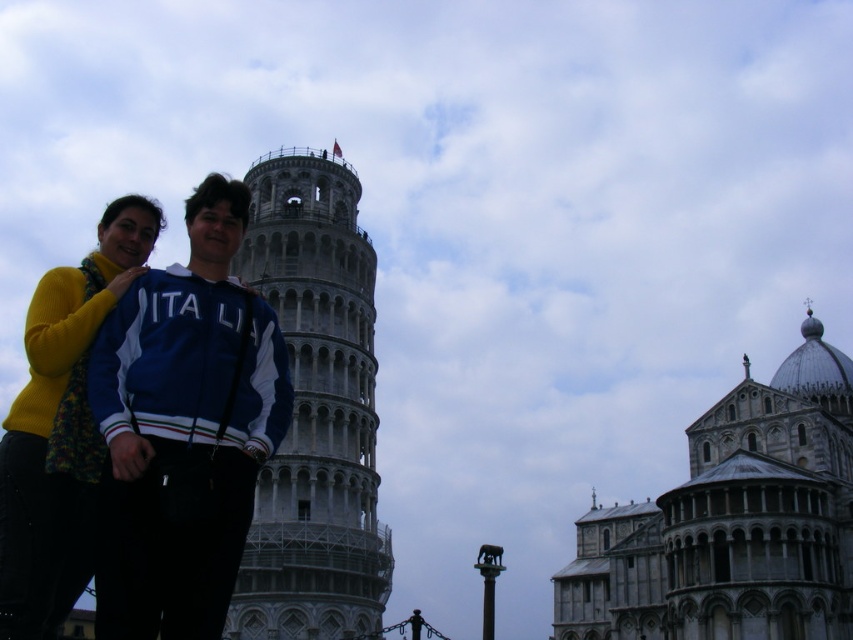
Question: Does gray stone tower at center appear on the left side of blue fabric jacket at center?

Choices:
 (A) no
 (B) yes

Answer: (A)

Question: Based on their relative distances, which object is nearer to the white stone tower at center?

Choices:
 (A) blue fabric jacket at center
 (B) gray stone tower at center

Answer: (B)

Question: From the image, what is the correct spatial relationship of gray stone tower at center in relation to blue fabric jacket at center?

Choices:
 (A) below
 (B) above

Answer: (A)

Question: Which object appears closest to the camera in this image?

Choices:
 (A) gray stone tower at center
 (B) white stone tower at center

Answer: (B)

Question: Among these points, which one is farthest from the camera?

Choices:
 (A) tap(782, 570)
 (B) tap(281, 230)

Answer: (A)

Question: Considering the relative positions of gray stone tower at center and blue fabric jacket at center in the image provided, where is gray stone tower at center located with respect to blue fabric jacket at center?

Choices:
 (A) left
 (B) right

Answer: (B)